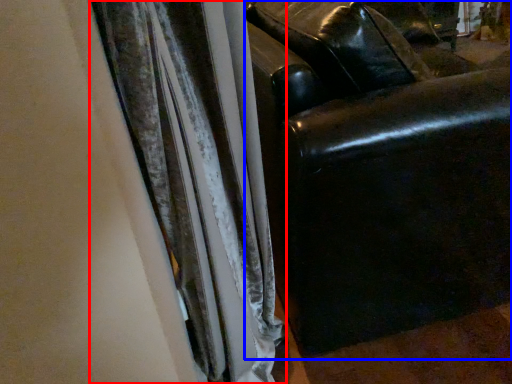
Question: Which of the following is the farthest to the observer, curtain (highlighted by a red box) or furniture (highlighted by a blue box)?

Choices:
 (A) curtain
 (B) furniture

Answer: (B)